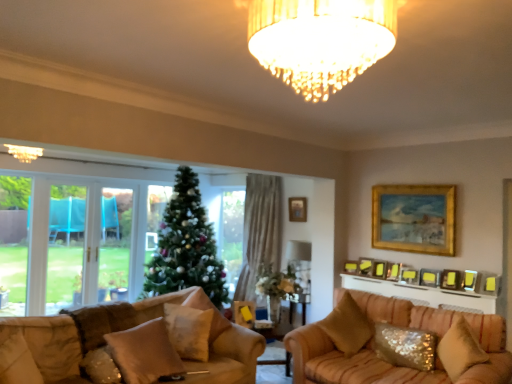
Question: From a real-world perspective, is gold metallic picture frame at upper center, placed as the 4th picture frame when sorted from back to front, on top of wooden picture frame at upper right, which is the first picture frame from front to back?

Choices:
 (A) no
 (B) yes

Answer: (B)

Question: Is gold metallic picture frame at upper center, placed as the 4th picture frame when sorted from back to front, placed right next to wooden picture frame at upper right, which is the 8th picture frame in back-to-front order?

Choices:
 (A) no
 (B) yes

Answer: (A)

Question: Considering the relative sizes of gold metallic picture frame at upper center, positioned as the 5th picture frame in front-to-back order, and wooden picture frame at upper right, which is the first picture frame from front to back, in the image provided, is gold metallic picture frame at upper center, positioned as the 5th picture frame in front-to-back order, thinner than wooden picture frame at upper right, which is the first picture frame from front to back,?

Choices:
 (A) yes
 (B) no

Answer: (B)

Question: Does gold metallic picture frame at upper center, positioned as the 5th picture frame in front-to-back order, have a larger size compared to wooden picture frame at upper right, which is the first picture frame from front to back?

Choices:
 (A) yes
 (B) no

Answer: (A)

Question: Is gold metallic picture frame at upper center, placed as the 4th picture frame when sorted from back to front, outside wooden picture frame at upper right, which is the 8th picture frame in back-to-front order?

Choices:
 (A) no
 (B) yes

Answer: (B)

Question: Is point (207, 352) positioned closer to the camera than point (305, 6)?

Choices:
 (A) farther
 (B) closer

Answer: (A)

Question: From the image's perspective, relative to golden crystal chandelier at center, positioned as the 2th light fixture in back-to-front order, is white sequined pillow at center, which is counted as the fourth pillow, starting from the left, above or below?

Choices:
 (A) below
 (B) above

Answer: (A)

Question: Looking at their shapes, would you say white sequined pillow at center, the fifth pillow viewed from the right, is wider or thinner than golden crystal chandelier at center, the first light fixture when ordered from front to back?

Choices:
 (A) thin
 (B) wide

Answer: (A)

Question: In terms of size, does white sequined pillow at center, the fifth pillow viewed from the right, appear bigger or smaller than golden crystal chandelier at center, marked as the second light fixture in a left-to-right arrangement?

Choices:
 (A) small
 (B) big

Answer: (A)

Question: Looking at the image, does gold-framed picture at upper center, marked as the fourth picture frame in a front-to-back arrangement, seem bigger or smaller compared to golden crystal chandelier at center, the 1th light fixture positioned from the right?

Choices:
 (A) big
 (B) small

Answer: (B)

Question: From the image's perspective, is gold-framed picture at upper center, the fifth picture frame in the back-to-front sequence, above or below golden crystal chandelier at center, positioned as the 2th light fixture in back-to-front order?

Choices:
 (A) above
 (B) below

Answer: (B)

Question: In the image, is gold-framed picture at upper center, the fifth picture frame in the back-to-front sequence, positioned in front of or behind golden crystal chandelier at center, positioned as the 2th light fixture in back-to-front order?

Choices:
 (A) front
 (B) behind

Answer: (B)

Question: In terms of width, does gold-framed picture at upper center, the fifth picture frame in the back-to-front sequence, look wider or thinner when compared to golden crystal chandelier at center, marked as the second light fixture in a left-to-right arrangement?

Choices:
 (A) wide
 (B) thin

Answer: (B)

Question: Is gold-framed picture at upper center, arranged as the first picture frame when viewed from the back, wider or thinner than white sequined pillow at center, the fifth pillow viewed from the right?

Choices:
 (A) wide
 (B) thin

Answer: (B)

Question: From the image's perspective, relative to white sequined pillow at center, the fifth pillow viewed from the right, is gold-framed picture at upper center, positioned as the 8th picture frame in front-to-back order, above or below?

Choices:
 (A) below
 (B) above

Answer: (B)